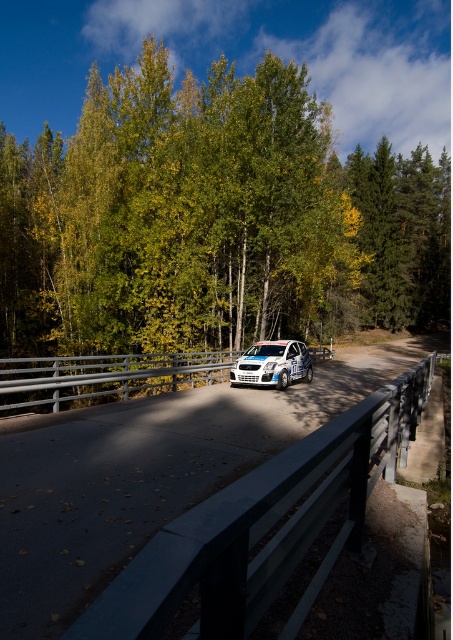
Question: Does green leafy tree at center have a lesser width compared to white glossy rally car at center?

Choices:
 (A) yes
 (B) no

Answer: (B)

Question: Which of these objects is positioned closest to the white glossy car at center?

Choices:
 (A) green leafy tree at center
 (B) white glossy rally car at center

Answer: (B)

Question: Among these objects, which one is farthest from the camera?

Choices:
 (A) green leafy tree at center
 (B) white glossy car at center
 (C) white glossy rally car at center

Answer: (A)

Question: Can you confirm if white glossy car at center is smaller than white glossy rally car at center?

Choices:
 (A) yes
 (B) no

Answer: (B)

Question: Observing the image, what is the correct spatial positioning of green leafy tree at center in reference to white glossy rally car at center?

Choices:
 (A) right
 (B) left

Answer: (A)

Question: Based on their relative distances, which object is nearer to the green leafy tree at center?

Choices:
 (A) white glossy car at center
 (B) white glossy rally car at center

Answer: (A)